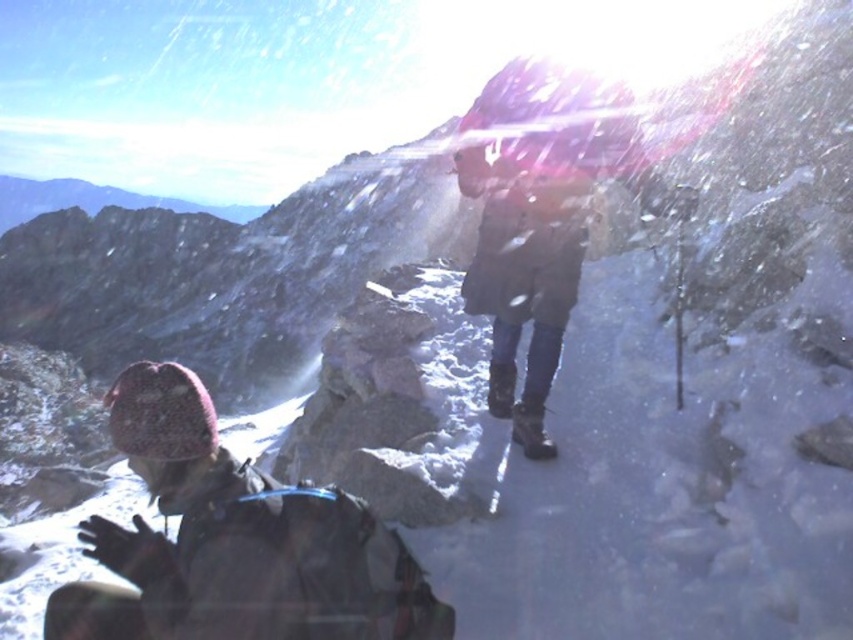
Question: Which point is farther to the camera?

Choices:
 (A) dark gray wool hat at lower left
 (B) brown leather jacket at center

Answer: (B)

Question: Does dark gray wool hat at lower left have a greater width compared to brown leather jacket at center?

Choices:
 (A) no
 (B) yes

Answer: (B)

Question: Which of the following is the closest to the observer?

Choices:
 (A) (560, 77)
 (B) (354, 560)

Answer: (B)

Question: Which of the following is the farthest from the observer?

Choices:
 (A) (107, 600)
 (B) (550, 300)

Answer: (B)

Question: Does dark gray wool hat at lower left have a lesser width compared to brown leather jacket at center?

Choices:
 (A) yes
 (B) no

Answer: (B)

Question: Considering the relative positions of dark gray wool hat at lower left and brown leather jacket at center in the image provided, where is dark gray wool hat at lower left located with respect to brown leather jacket at center?

Choices:
 (A) above
 (B) below

Answer: (B)